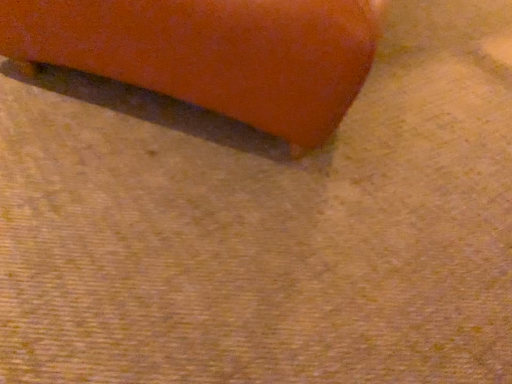
Describe the element at coordinates (212, 53) in the screenshot. I see `matte orange block at upper left` at that location.

The image size is (512, 384). Identify the location of matte orange block at upper left. (212, 53).

The image size is (512, 384). In order to click on matte orange block at upper left in this screenshot , I will do `click(212, 53)`.